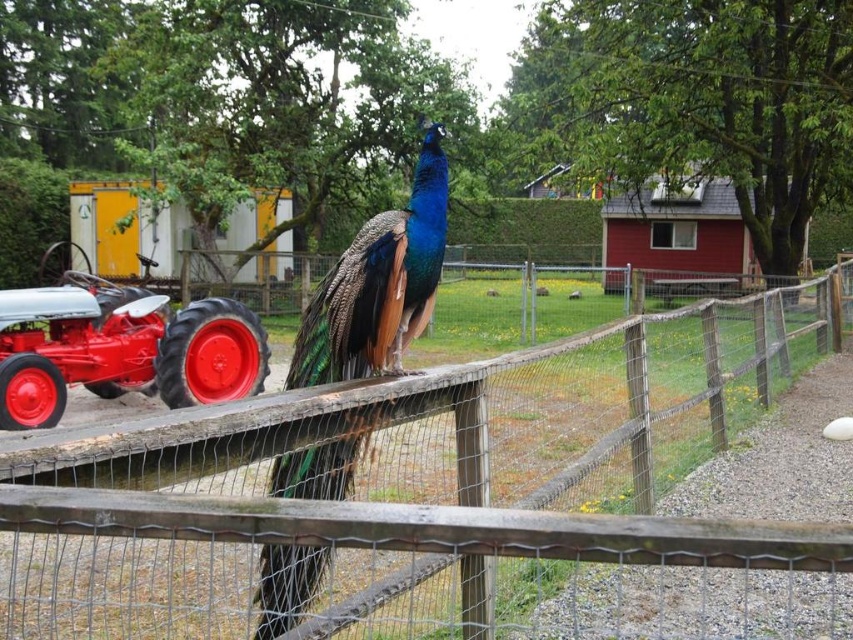
You are standing in front of the peacock on the wooden fence and want to place a small decoration between the two points, point [529,442] and point [345,272]. Which point is closer to you so you can place the decoration there?

Point [529,442] is further to the viewer than point [345,272], so the point closer to you is point [345,272]. Place the decoration there.

You are planning to take a photo of the wooden fence at center and the red painted metal tractor at left. Since you want both objects to be clearly visible in the frame, which object should you position closer to the camera to ensure they appear the same size in your photo?

The wooden fence at center should be positioned closer to the camera because its width is greater than the red painted metal tractor at left. By moving it closer, you can balance their apparent sizes in the photo.